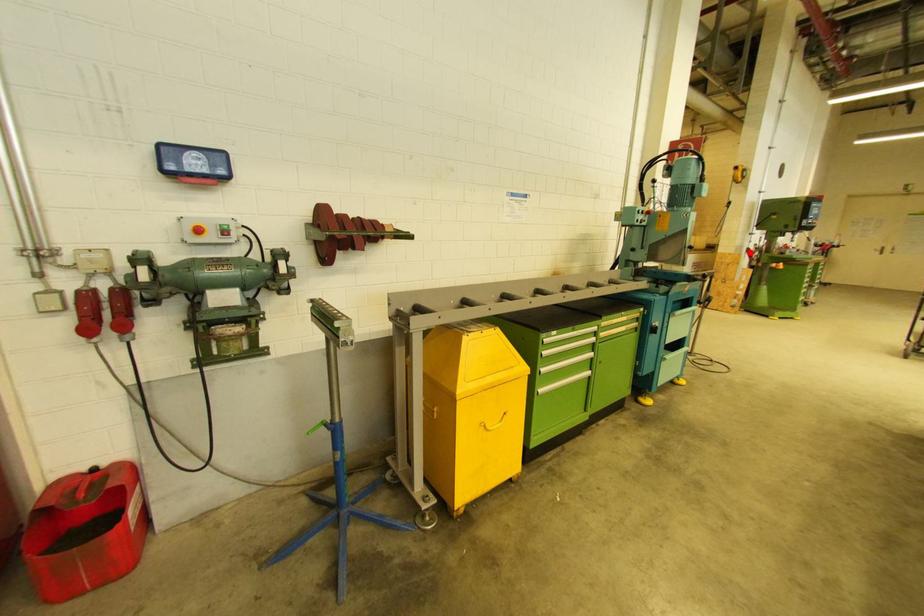
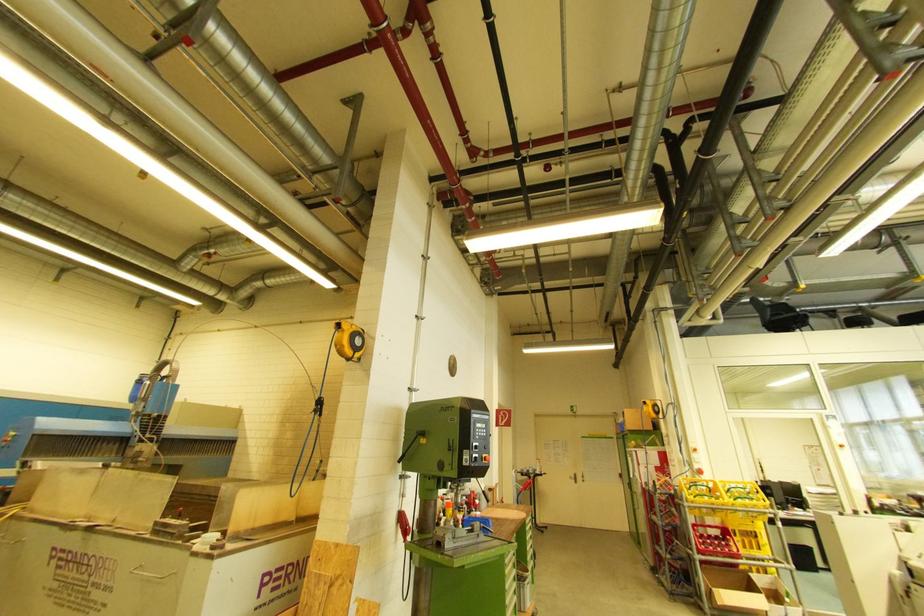
Question: I am providing you with two images of the same scene from different viewpoints. A red point is shown in image1. For the corresponding object point in image2, is it positioned nearer or farther from the camera?

Choices:
 (A) Nearer
 (B) Farther

Answer: (B)